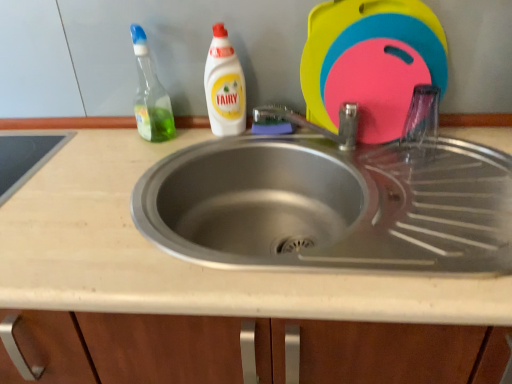
Question: Can you confirm if white plastic bottle at upper center, the second cleaning product when ordered from left to right, is positioned to the right of green translucent bottle at upper left, placed as the 1th cleaning product when sorted from left to right?

Choices:
 (A) yes
 (B) no

Answer: (A)

Question: Does white plastic bottle at upper center, the second cleaning product when ordered from left to right, have a larger size compared to green translucent bottle at upper left, acting as the second cleaning product starting from the right?

Choices:
 (A) yes
 (B) no

Answer: (B)

Question: Can you confirm if white plastic bottle at upper center, positioned as the 1th cleaning product in right-to-left order, is wider than green translucent bottle at upper left, placed as the 1th cleaning product when sorted from left to right?

Choices:
 (A) yes
 (B) no

Answer: (B)

Question: Is white plastic bottle at upper center, the second cleaning product when ordered from left to right, positioned behind green translucent bottle at upper left, acting as the second cleaning product starting from the right?

Choices:
 (A) no
 (B) yes

Answer: (B)

Question: Is white plastic bottle at upper center, the second cleaning product when ordered from left to right, outside of green translucent bottle at upper left, acting as the second cleaning product starting from the right?

Choices:
 (A) yes
 (B) no

Answer: (A)

Question: From a real-world perspective, is white plastic bottle at upper center, the second cleaning product when ordered from left to right, over green translucent bottle at upper left, placed as the 1th cleaning product when sorted from left to right?

Choices:
 (A) no
 (B) yes

Answer: (A)

Question: Does beige laminate countertop at center lie behind white plastic bottle at upper center, the second cleaning product when ordered from left to right?

Choices:
 (A) yes
 (B) no

Answer: (B)

Question: Are beige laminate countertop at center and white plastic bottle at upper center, positioned as the 1th cleaning product in right-to-left order, far apart?

Choices:
 (A) yes
 (B) no

Answer: (B)

Question: From a real-world perspective, is beige laminate countertop at center positioned under white plastic bottle at upper center, the second cleaning product when ordered from left to right, based on gravity?

Choices:
 (A) no
 (B) yes

Answer: (B)

Question: From a real-world perspective, is beige laminate countertop at center over white plastic bottle at upper center, the second cleaning product when ordered from left to right?

Choices:
 (A) no
 (B) yes

Answer: (A)

Question: From the image's perspective, is beige laminate countertop at center below white plastic bottle at upper center, positioned as the 1th cleaning product in right-to-left order?

Choices:
 (A) yes
 (B) no

Answer: (A)

Question: Does beige laminate countertop at center come in front of white plastic bottle at upper center, positioned as the 1th cleaning product in right-to-left order?

Choices:
 (A) yes
 (B) no

Answer: (A)

Question: From the image's perspective, would you say beige laminate countertop at center is shown under green translucent bottle at upper left, acting as the second cleaning product starting from the right?

Choices:
 (A) yes
 (B) no

Answer: (A)